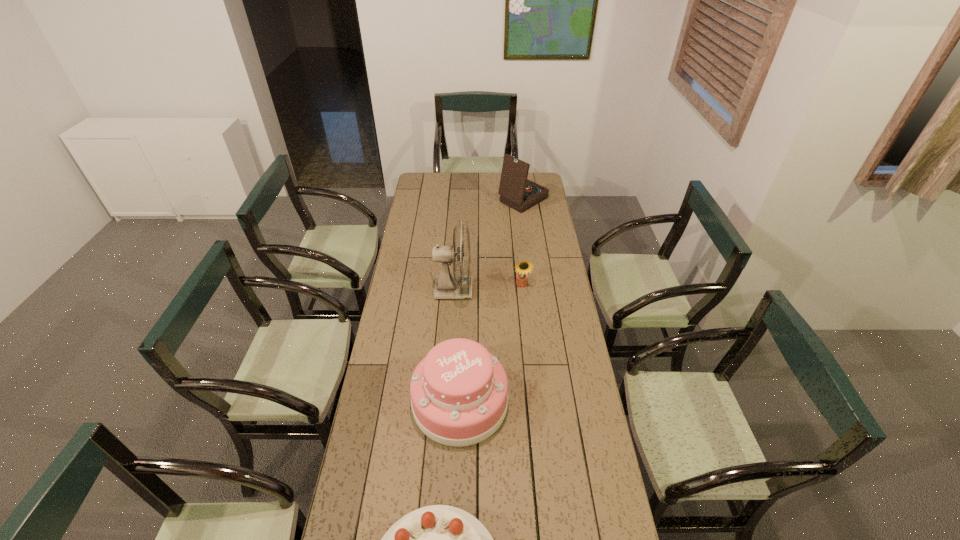
I want to click on free spot that satisfies the following two spatial constraints: 1. on the front-facing side of the third shortest object; 2. on the left side of the tallest object, so click(x=446, y=402).

The width and height of the screenshot is (960, 540). Find the location of `free spot that satisfies the following two spatial constraints: 1. on the face of the sunflower; 2. on the front-facing side of the tallest object`. free spot that satisfies the following two spatial constraints: 1. on the face of the sunflower; 2. on the front-facing side of the tallest object is located at coordinates [522, 290].

Image resolution: width=960 pixels, height=540 pixels. I want to click on blank space that satisfies the following two spatial constraints: 1. on the front-facing side of the fan; 2. on the right side of the fourth farthest object, so click(446, 402).